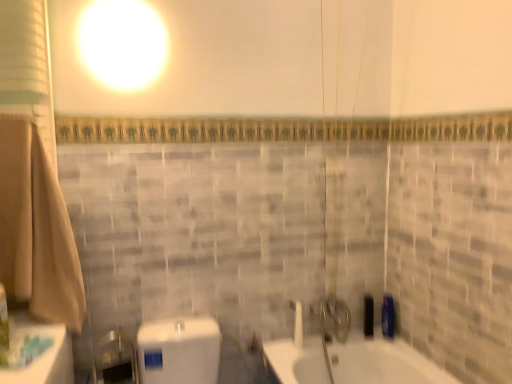
Question: Considering the positions of beige cotton bath towel at left and white glossy shower at center in the image, is beige cotton bath towel at left wider or thinner than white glossy shower at center?

Choices:
 (A) wide
 (B) thin

Answer: (A)

Question: Is beige cotton bath towel at left spatially inside white glossy shower at center, or outside of it?

Choices:
 (A) outside
 (B) inside

Answer: (A)

Question: Which of these objects is positioned closest to the blue glossy bottle at right, the third toiletry positioned from the left?

Choices:
 (A) white glossy shower at center
 (B) beige cotton bath towel at left
 (C) black matte soap dispenser at right, the third toiletry from the front
 (D) green plastic toothbrush at lower left, the third toiletry from the right

Answer: (C)

Question: Which object is positioned closest to the white glossy shower at center?

Choices:
 (A) black matte soap dispenser at right, placed as the first toiletry when sorted from back to front
 (B) blue glossy bottle at right, acting as the second toiletry starting from the back
 (C) green plastic toothbrush at lower left, the 1th toiletry from the front
 (D) beige cotton bath towel at left

Answer: (A)